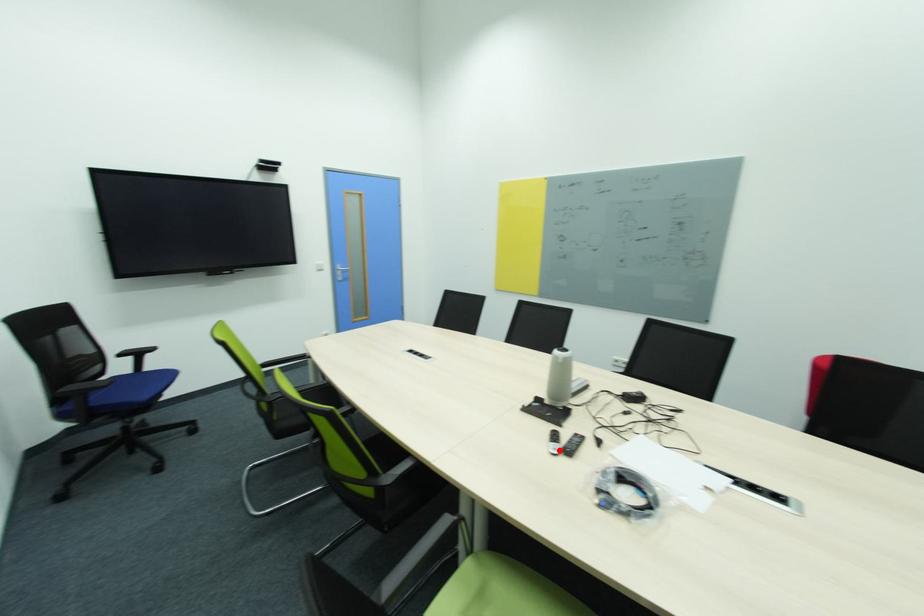
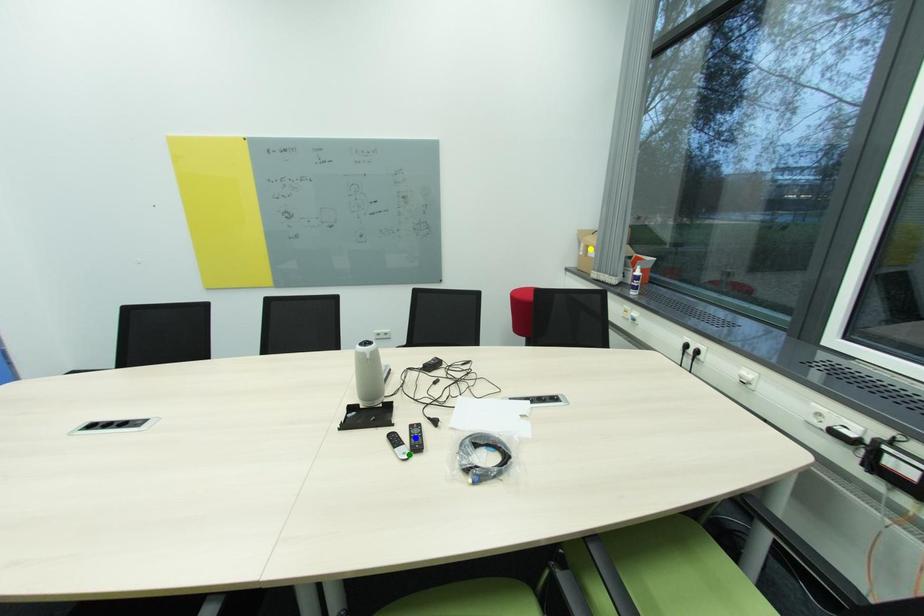
Question: I am providing you with two images of the same scene from different viewpoints. A red point is marked on the first image. You are given multiple points on the second image. Which point in image 2 represents the same 3d spot as the red point in image 1?

Choices:
 (A) green point
 (B) yellow point
 (C) blue point

Answer: (A)